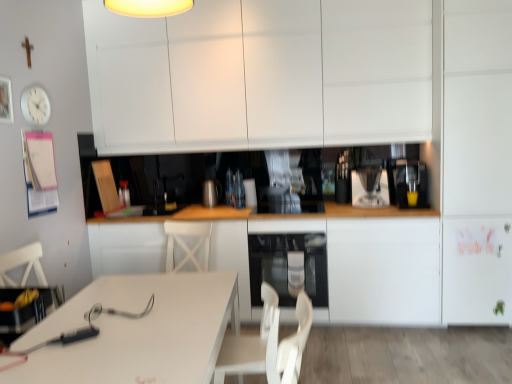
Where is `vacant area that is in front of satin silver kettle at center, the 1th appliance when ordered from back to front`? Image resolution: width=512 pixels, height=384 pixels. vacant area that is in front of satin silver kettle at center, the 1th appliance when ordered from back to front is located at coordinates (208, 206).